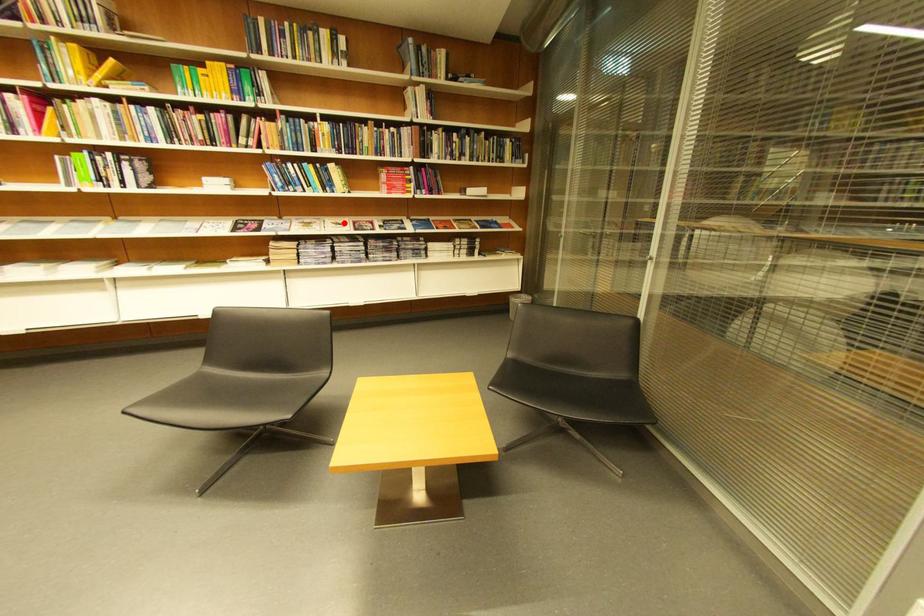
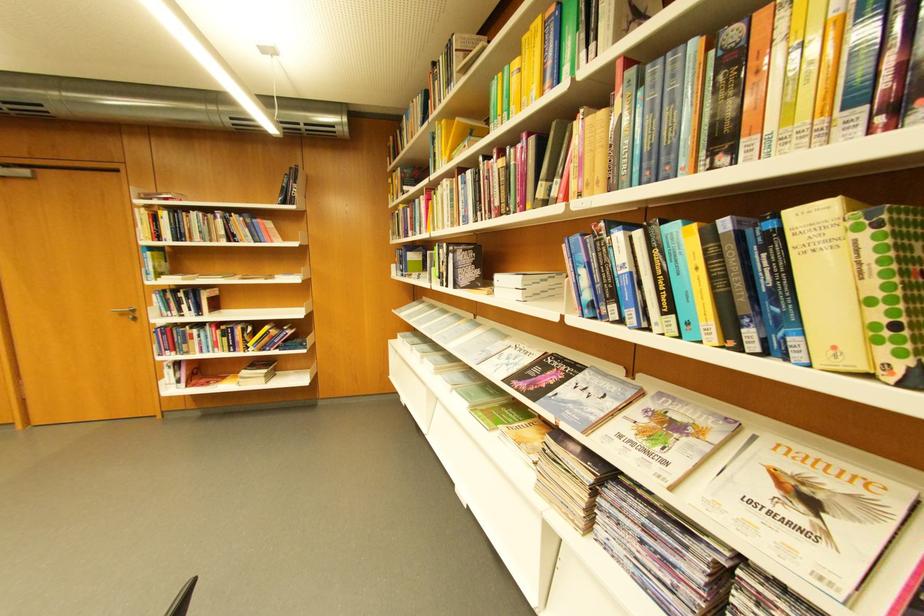
Where in the second image is the point corresponding to the highlighted location from the first image?

(800, 469)